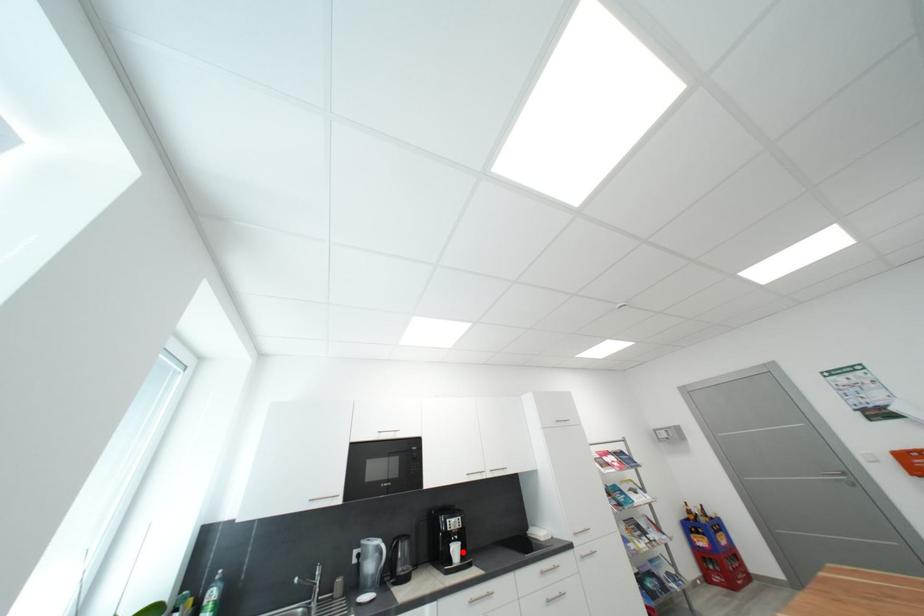
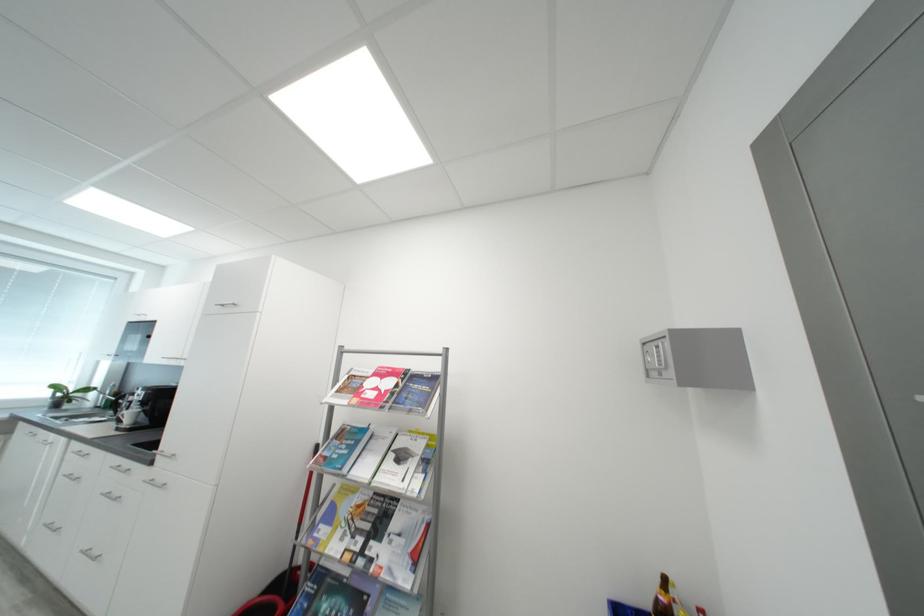
Question: I am providing you with two images of the same scene from different viewpoints. In image1, a red point is highlighted. Considering the same 3D point in image2, which of the following is correct?

Choices:
 (A) It is closer
 (B) It is farther

Answer: (A)